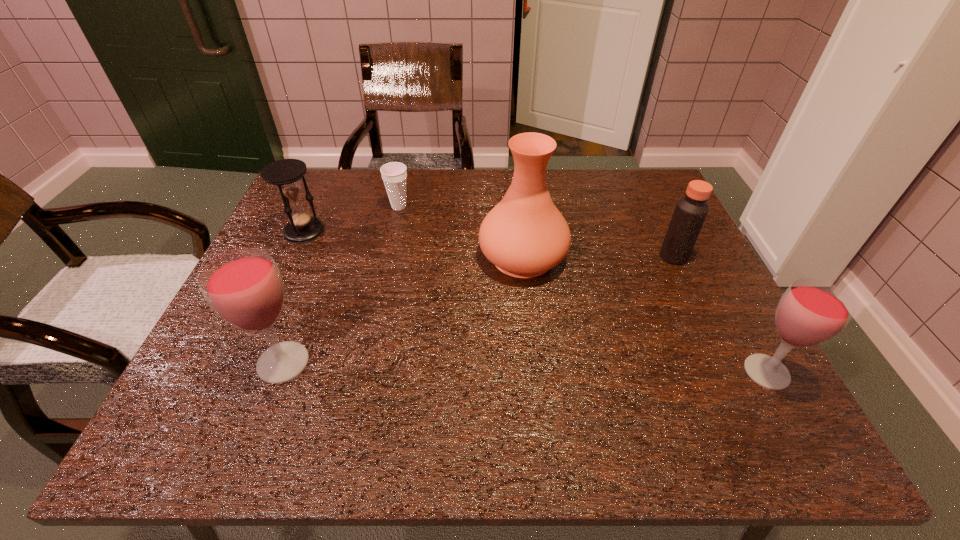
Image resolution: width=960 pixels, height=540 pixels. Identify the location of free area in between the farthest object and the tallest object. (461, 232).

Locate an element on the screen. Image resolution: width=960 pixels, height=540 pixels. empty location between the third object from left to right and the hourglass is located at coordinates (351, 219).

Where is `empty space that is in between the vase and the vinegar`? This screenshot has height=540, width=960. empty space that is in between the vase and the vinegar is located at coordinates (598, 256).

Locate an element on the screen. The image size is (960, 540). vacant area between the shorter wineglass and the tallest object is located at coordinates (645, 314).

This screenshot has height=540, width=960. I want to click on vacant area between the cup and the left wineglass, so click(341, 285).

Where is `blank region between the third object from right to left and the taller wineglass`? blank region between the third object from right to left and the taller wineglass is located at coordinates (403, 310).

Select which object is the second closest to the left wineglass. Please provide its 2D coordinates. Your answer should be formatted as a tuple, i.e. [(x, y)], where the tuple contains the x and y coordinates of a point satisfying the conditions above.

[(524, 235)]

The width and height of the screenshot is (960, 540). Find the location of `object that is the closest to the vinegar`. object that is the closest to the vinegar is located at coordinates click(524, 235).

I want to click on free location that satisfies the following two spatial constraints: 1. on the front side of the third object from right to left; 2. on the left side of the hourglass, so click(292, 257).

The height and width of the screenshot is (540, 960). In order to click on free space that satisfies the following two spatial constraints: 1. on the front side of the right wineglass; 2. on the left side of the third object from left to right in this screenshot , I will do `click(362, 372)`.